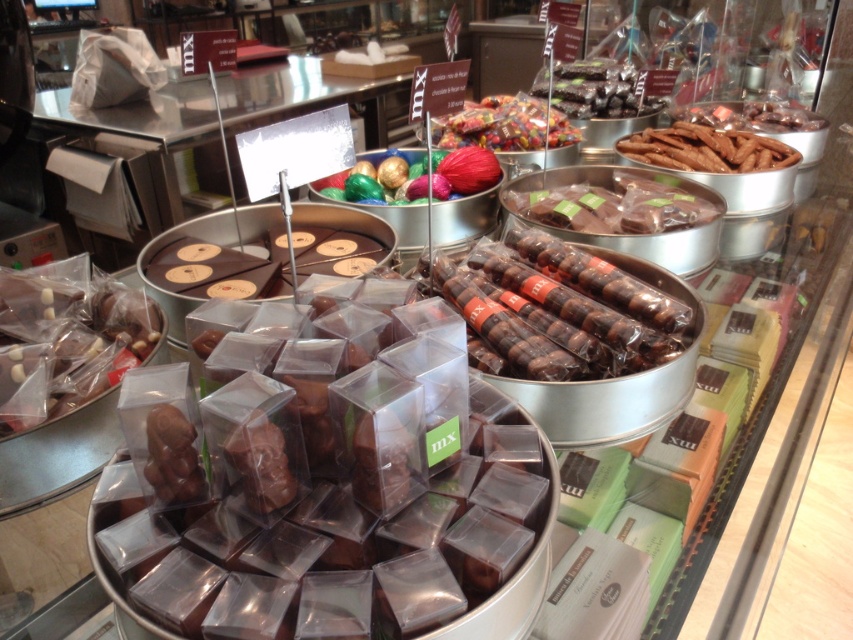
You are a customer at the chocolate shop and want to choose between the matte chocolate candy at left and the shiny chocolate truffle at upper center. Which one is wider?

The shiny chocolate truffle at upper center is wider than the matte chocolate candy at left.

You are standing in front of the display case and want to pick up the item located at point (16,275). Can you reach it without moving closer than 1 meter?

The distance of point (16,275) from viewer is 1.06 meters, so yes, you can reach it without moving closer than 1 meter since it is slightly farther than 1 meter away.